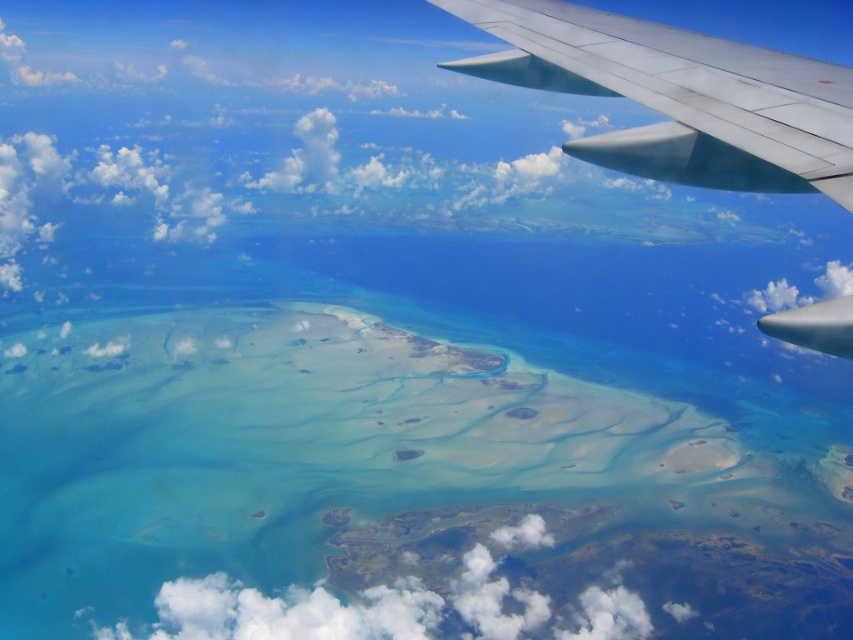
Does translucent sandbar at center appear on the right side of white fluffy cloud at center?

Yes, translucent sandbar at center is to the right of white fluffy cloud at center.

Is point (38, 618) more distant than point (364, 525)?

No, (38, 618) is in front of (364, 525).

Does point (480, 472) come closer to viewer compared to point (668, 614)?

No, (480, 472) is behind (668, 614).

You are a GUI agent. You are given a task and a screenshot of the screen. Output one action in this format:
    pyautogui.click(x=<x>, y=<y>)
    Task: Click on the translucent sandbar at center
    This screenshot has height=640, width=853.
    Given the screenshot: What is the action you would take?
    pyautogui.click(x=399, y=488)

From the picture: Does translucent sandbar at center have a lesser height compared to metallic silver wing at upper right?

In fact, translucent sandbar at center may be taller than metallic silver wing at upper right.

Is translucent sandbar at center thinner than metallic silver wing at upper right?

Incorrect, translucent sandbar at center's width is not less than metallic silver wing at upper right's.

Does point (618, 529) come in front of point (849, 326)?

No, (618, 529) is further to viewer.

Locate an element on the screen. The width and height of the screenshot is (853, 640). translucent sandbar at center is located at coordinates (399, 488).

Which is above, metallic silver wing at upper right or white fluffy cloud at center?

Positioned higher is metallic silver wing at upper right.

Can you confirm if metallic silver wing at upper right is thinner than white fluffy cloud at center?

Yes, metallic silver wing at upper right is thinner than white fluffy cloud at center.

The height and width of the screenshot is (640, 853). What do you see at coordinates (679, 97) in the screenshot?
I see `metallic silver wing at upper right` at bounding box center [679, 97].

At what (x,y) coordinates should I click in order to perform the action: click on metallic silver wing at upper right. Please return your answer as a coordinate pair (x, y). The height and width of the screenshot is (640, 853). Looking at the image, I should click on (679, 97).